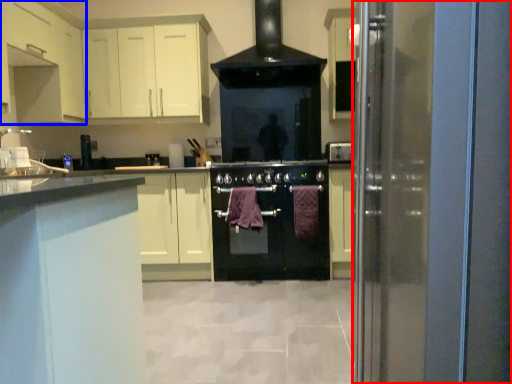
Question: Which point is further to the camera, glass door (highlighted by a red box) or cabinetry (highlighted by a blue box)?

Choices:
 (A) glass door
 (B) cabinetry

Answer: (B)